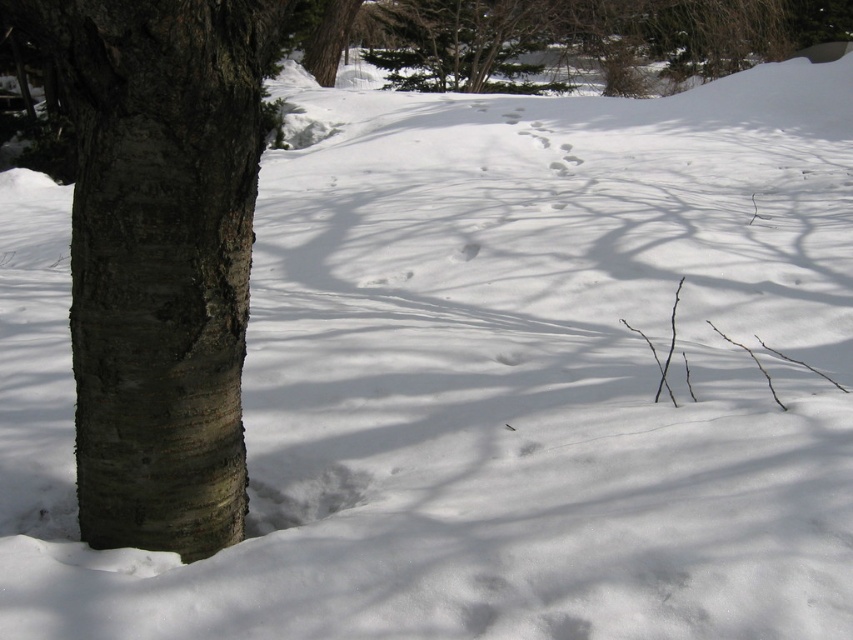
Does smooth bark tree trunk at left come behind green textured pine tree at upper center?

No, it is in front of green textured pine tree at upper center.

Does smooth bark tree trunk at left appear over green textured pine tree at upper center?

No.

Is point (160, 248) farther from viewer compared to point (840, 36)?

No, (160, 248) is closer to viewer.

Identify the location of smooth bark tree trunk at left. (160, 257).